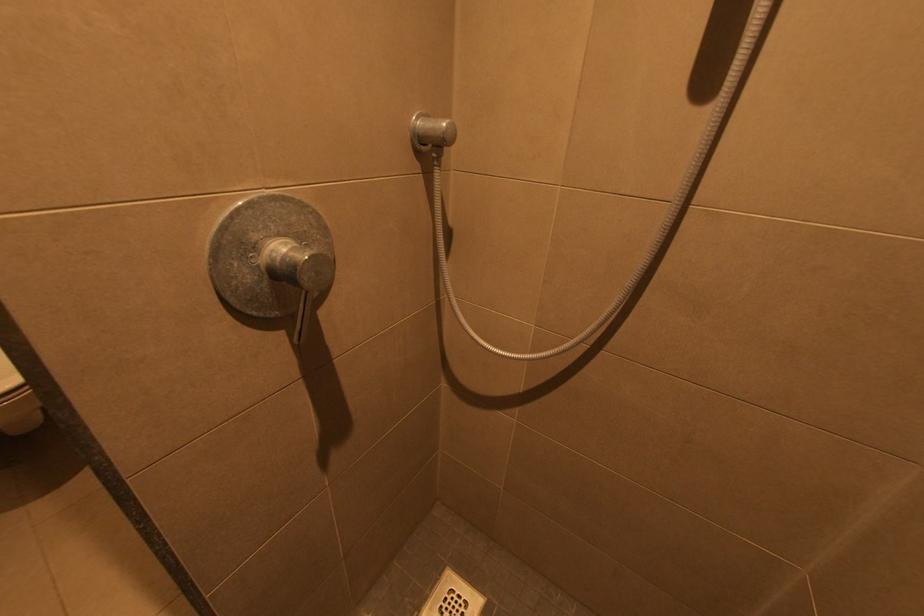
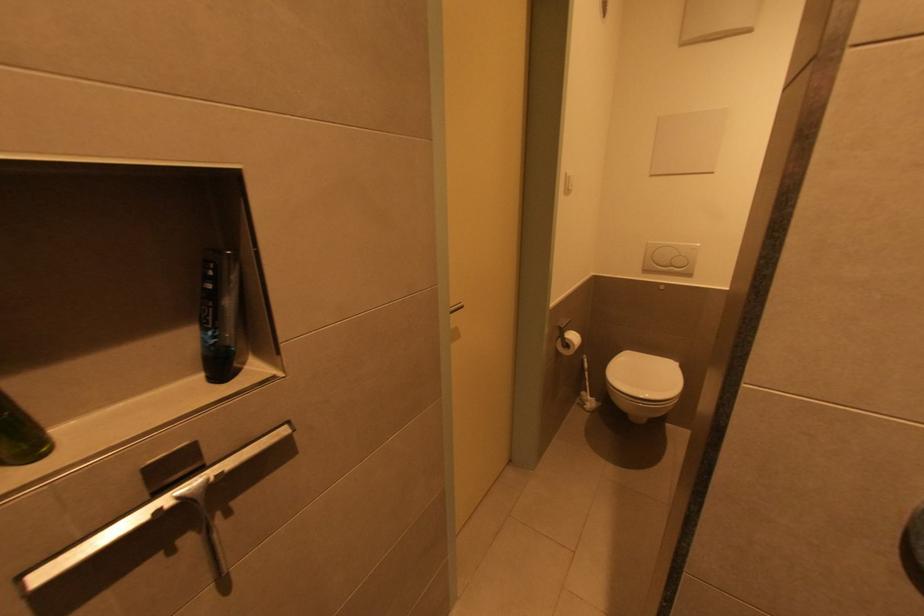
Question: Based on the continuous images, in which direction is the camera rotating? Reply with the corresponding letter.

Choices:
 (A) Left
 (B) Right
 (C) Up
 (D) Down

Answer: (A)